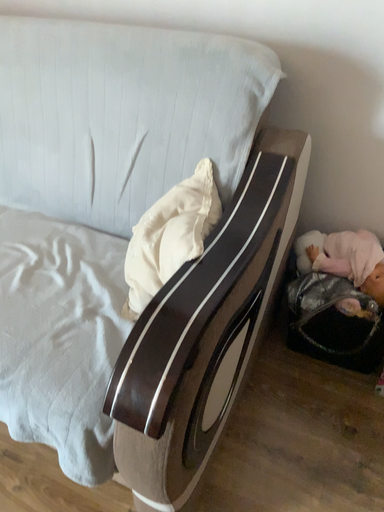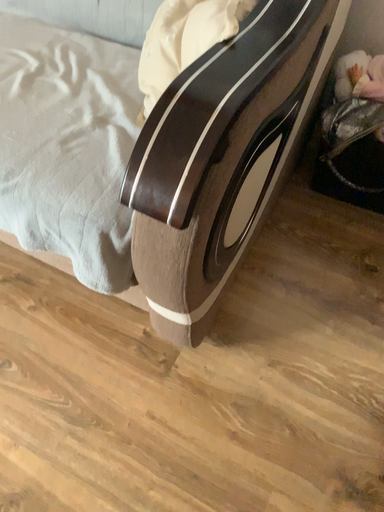
Question: How did the camera likely rotate when shooting the video?

Choices:
 (A) rotated downward
 (B) rotated upward

Answer: (A)